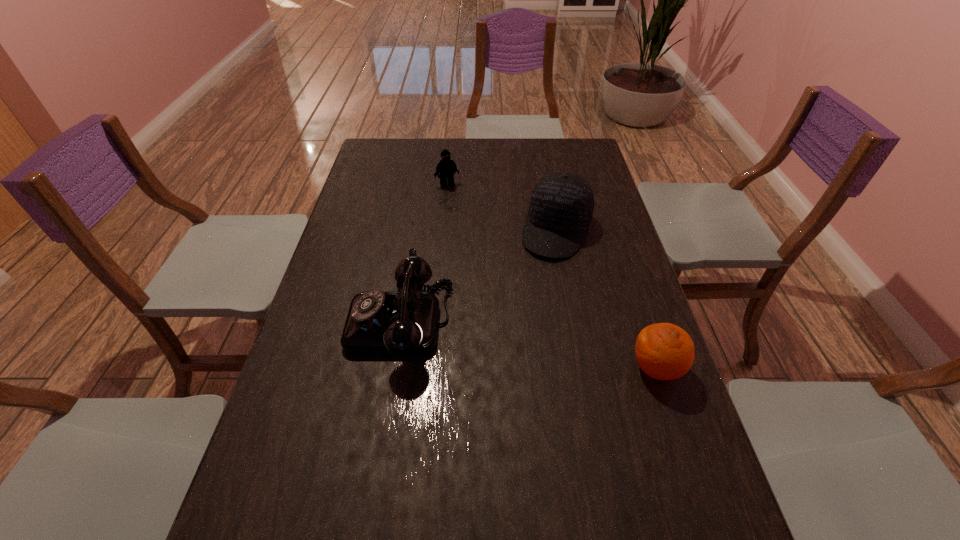
You are a GUI agent. You are given a task and a screenshot of the screen. Output one action in this format:
    pyautogui.click(x=<x>, y=<y>)
    Task: Click on the empty location between the baseball cap and the farthest object
    
    Given the screenshot: What is the action you would take?
    pyautogui.click(x=502, y=207)

Where is `free space between the orange and the telephone`? This screenshot has height=540, width=960. free space between the orange and the telephone is located at coordinates (528, 345).

The width and height of the screenshot is (960, 540). I want to click on object identified as the closest to the telephone, so click(561, 206).

Locate which object ranks third in proximity to the Lego. Please provide its 2D coordinates. Your answer should be formatted as a tuple, i.e. [(x, y)], where the tuple contains the x and y coordinates of a point satisfying the conditions above.

[(664, 351)]

Identify the location of vacant area in the image that satisfies the following two spatial constraints: 1. on the front side of the orange; 2. on the right side of the Lego. (430, 368).